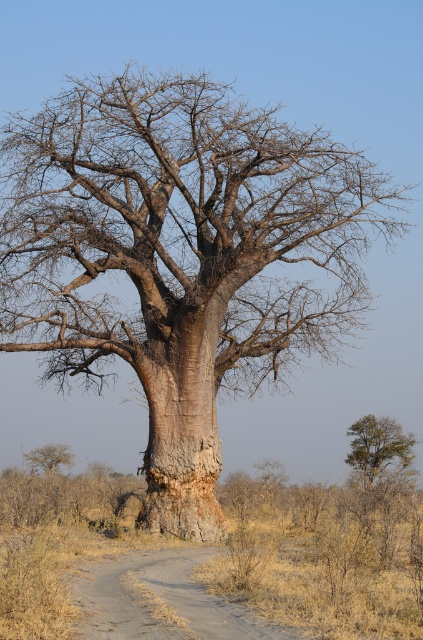
Between brown dirt track at lower center and green leafy tree at upper right, which one has less height?

brown dirt track at lower center

Between brown dirt track at lower center and green leafy tree at upper right, which one is positioned lower?

Positioned lower is green leafy tree at upper right.

Is point (142, 586) less distant than point (387, 426)?

Yes, point (142, 586) is closer to viewer.

Locate an element on the screen. The height and width of the screenshot is (640, 423). brown dirt track at lower center is located at coordinates (162, 600).

Does green leafy tree at upper right have a lesser height compared to gray bark tree at lower left?

No, green leafy tree at upper right is not shorter than gray bark tree at lower left.

Is green leafy tree at upper right thinner than gray bark tree at lower left?

In fact, green leafy tree at upper right might be wider than gray bark tree at lower left.

Which is behind, point (368, 417) or point (73, 464)?

The point (368, 417) is behind.

The width and height of the screenshot is (423, 640). I want to click on green leafy tree at upper right, so coord(378,444).

Which is in front, point (145, 636) or point (63, 445)?

Point (145, 636) is in front.

Identify the location of brown dirt track at lower center. Image resolution: width=423 pixels, height=640 pixels. (162, 600).

The width and height of the screenshot is (423, 640). I want to click on brown dirt track at lower center, so click(x=162, y=600).